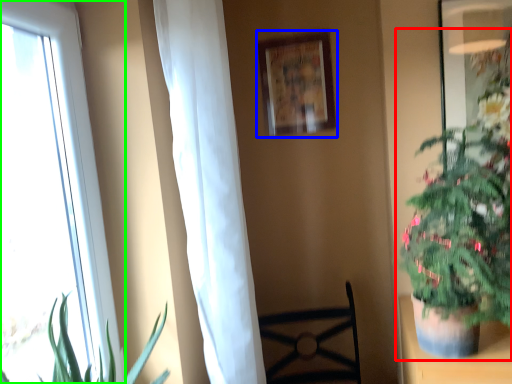
Question: Which object is the farthest from houseplant (highlighted by a red box)? Choose among these: picture frame (highlighted by a blue box) or window (highlighted by a green box).

Choices:
 (A) picture frame
 (B) window

Answer: (B)